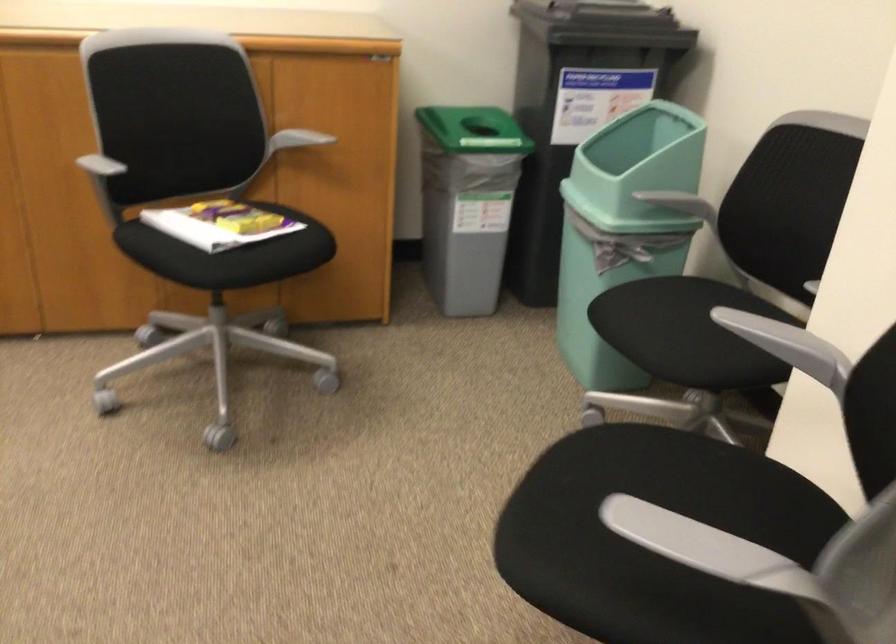
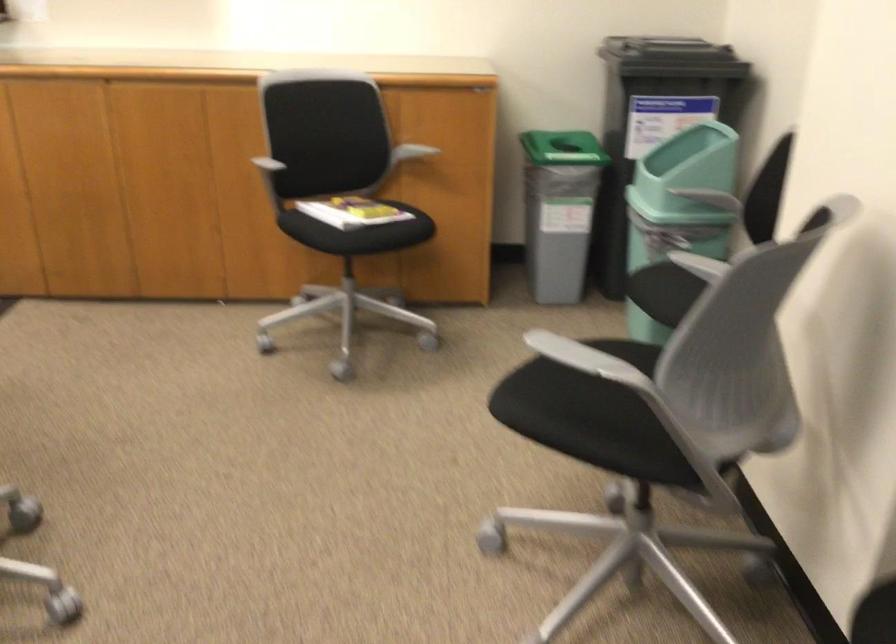
Where in the second image is the point corresponding to [238,256] from the first image?

(358, 232)